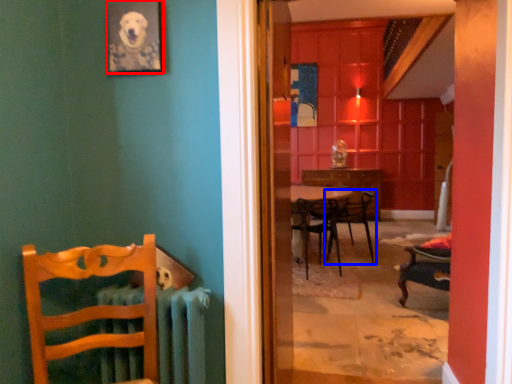
Question: Among these objects, which one is farthest to the camera, picture frame (highlighted by a red box) or chair (highlighted by a blue box)?

Choices:
 (A) picture frame
 (B) chair

Answer: (B)